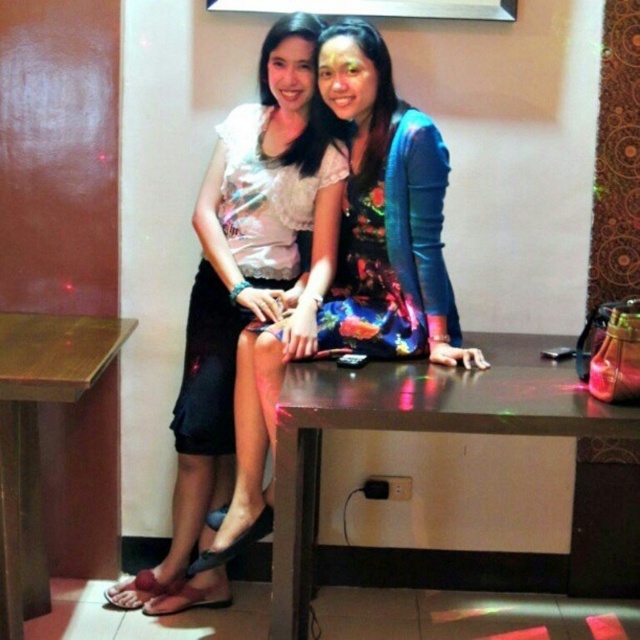
You are a waiter at the table where the two people are sitting. You need to place a new drink order at point (385, 214). However, there is already an item at that location. What object is currently occupying that spot?

The point (385, 214) is occupied by the matte floral dress at center.

You are a photographer trying to capture a closeup shot of the small black object on the table. You notice two points marked on the table surface. Which point, point [301,442] or point [269,241], is closer to your camera lens?

Point [301,442] is closer to the viewer than point [269,241], so the photographer should focus on point [301,442] to capture the small black object closer to the camera lens.

You are a server at the restaurant and need to place a new drink order on the table. Considering the space available, will the drink fit on the metallic brown table at center without overlapping the floral satin dress at center?

The metallic brown table at center is wider than the floral satin dress at center, so the drink should fit without overlapping the dress.